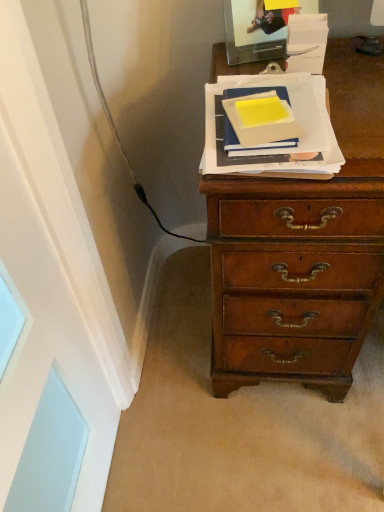
The height and width of the screenshot is (512, 384). I want to click on free spot above blue matte book at center, which is the first paperback book from right to left (from a real-world perspective), so click(274, 105).